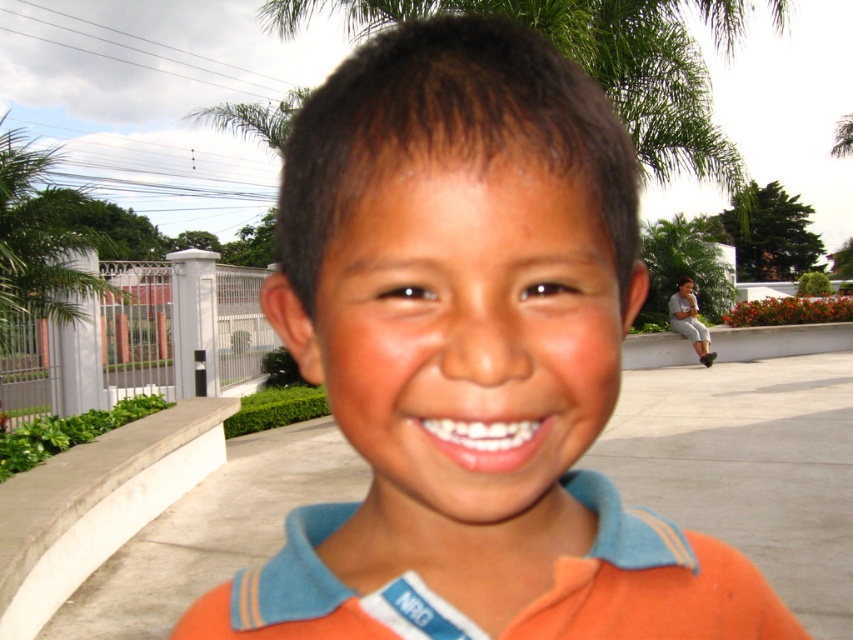
Question: Can you confirm if orange cotton shirt at center is positioned to the left of orange cotton polo shirt at center?

Choices:
 (A) no
 (B) yes

Answer: (A)

Question: Where is orange cotton polo shirt at center located in relation to matte gray pants at lower right in the image?

Choices:
 (A) above
 (B) below

Answer: (B)

Question: Which point appears farthest from the camera in this image?

Choices:
 (A) (732, 3)
 (B) (508, 589)
 (C) (48, 304)

Answer: (A)

Question: Is orange cotton shirt at center wider than orange cotton polo shirt at center?

Choices:
 (A) no
 (B) yes

Answer: (A)

Question: Among these points, which one is nearest to the camera?

Choices:
 (A) (293, 198)
 (B) (64, 252)
 (C) (700, 362)

Answer: (A)

Question: Which of these objects is positioned closest to the green leafy palm tree at upper center?

Choices:
 (A) matte gray pants at lower right
 (B) green leafy palm tree at upper left

Answer: (A)